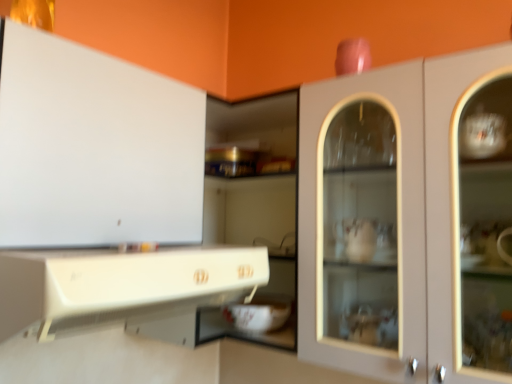
Question: Which direction should I rotate to look at matte white cabinet at center, arranged as the third cabinetry when viewed from the left, — up or down?

Choices:
 (A) down
 (B) up

Answer: (A)

Question: Is matte white cabinet at center, arranged as the third cabinetry when viewed from the left, wider than white glossy cabinet at lower left, arranged as the 2th cabinetry when viewed from the right?

Choices:
 (A) yes
 (B) no

Answer: (B)

Question: From the image's perspective, is matte white cabinet at center, the 1th cabinetry viewed from the right, over white glossy cabinet at lower left, arranged as the 2th cabinetry when viewed from the right?

Choices:
 (A) yes
 (B) no

Answer: (A)

Question: Is matte white cabinet at center, arranged as the third cabinetry when viewed from the left, to the right of white glossy cabinet at lower left, arranged as the 2th cabinetry when viewed from the right, from the viewer's perspective?

Choices:
 (A) yes
 (B) no

Answer: (A)

Question: Is matte white cabinet at center, arranged as the third cabinetry when viewed from the left, closer to camera compared to white glossy cabinet at lower left, arranged as the 2th cabinetry when viewed from the right?

Choices:
 (A) no
 (B) yes

Answer: (A)

Question: Is matte white cabinet at center, arranged as the third cabinetry when viewed from the left, aimed at white glossy cabinet at lower left, arranged as the 2th cabinetry when viewed from the right?

Choices:
 (A) yes
 (B) no

Answer: (A)

Question: Considering the relative positions of matte white cabinet at center, arranged as the third cabinetry when viewed from the left, and white glossy cabinet at lower left, which is the second cabinetry from left to right, in the image provided, is matte white cabinet at center, arranged as the third cabinetry when viewed from the left, behind white glossy cabinet at lower left, which is the second cabinetry from left to right,?

Choices:
 (A) yes
 (B) no

Answer: (A)

Question: Is white glossy cabinet at lower left, which is the second cabinetry from left to right, oriented towards matte white cabinet at center, the 1th cabinetry viewed from the right?

Choices:
 (A) yes
 (B) no

Answer: (B)

Question: Is white glossy cabinet at lower left, arranged as the 2th cabinetry when viewed from the right, not inside matte white cabinet at center, arranged as the third cabinetry when viewed from the left?

Choices:
 (A) yes
 (B) no

Answer: (A)

Question: From a real-world perspective, is white glossy cabinet at lower left, which is the second cabinetry from left to right, physically above matte white cabinet at center, arranged as the third cabinetry when viewed from the left?

Choices:
 (A) yes
 (B) no

Answer: (B)

Question: Is the depth of white glossy cabinet at lower left, which is the second cabinetry from left to right, greater than that of matte white cabinet at center, arranged as the third cabinetry when viewed from the left?

Choices:
 (A) yes
 (B) no

Answer: (B)

Question: From a real-world perspective, is white glossy cabinet at lower left, arranged as the 2th cabinetry when viewed from the right, beneath matte white cabinet at center, arranged as the third cabinetry when viewed from the left?

Choices:
 (A) no
 (B) yes

Answer: (B)

Question: From the image's perspective, is white glossy cabinet at lower left, arranged as the 2th cabinetry when viewed from the right, over matte white cabinet at center, the 1th cabinetry viewed from the right?

Choices:
 (A) no
 (B) yes

Answer: (A)

Question: Does white glossy cabinet at lower left, arranged as the 2th cabinetry when viewed from the right, have a greater height compared to white glossy cabinet at upper left, the 3th cabinetry when ordered from right to left?

Choices:
 (A) yes
 (B) no

Answer: (B)